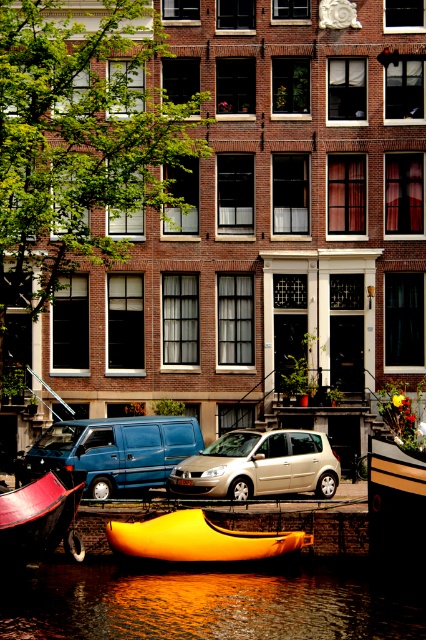
Question: Does blue matte van at center come in front of matte red boat at lower left?

Choices:
 (A) yes
 (B) no

Answer: (B)

Question: Which is nearer to the reflective water at lower center?

Choices:
 (A) blue matte van at center
 (B) metallic silver car at center
 (C) shiny yellow canoe at lower center

Answer: (C)

Question: From the image, what is the correct spatial relationship of reflective water at lower center in relation to metallic silver car at center?

Choices:
 (A) right
 (B) left

Answer: (A)

Question: Can you confirm if blue matte van at center is bigger than metallic silver car at center?

Choices:
 (A) yes
 (B) no

Answer: (B)

Question: Which of the following is the closest to the observer?

Choices:
 (A) (109, 529)
 (B) (190, 480)
 (C) (106, 496)

Answer: (A)

Question: Which point appears farthest from the camera in this image?

Choices:
 (A) (244, 598)
 (B) (193, 525)

Answer: (B)